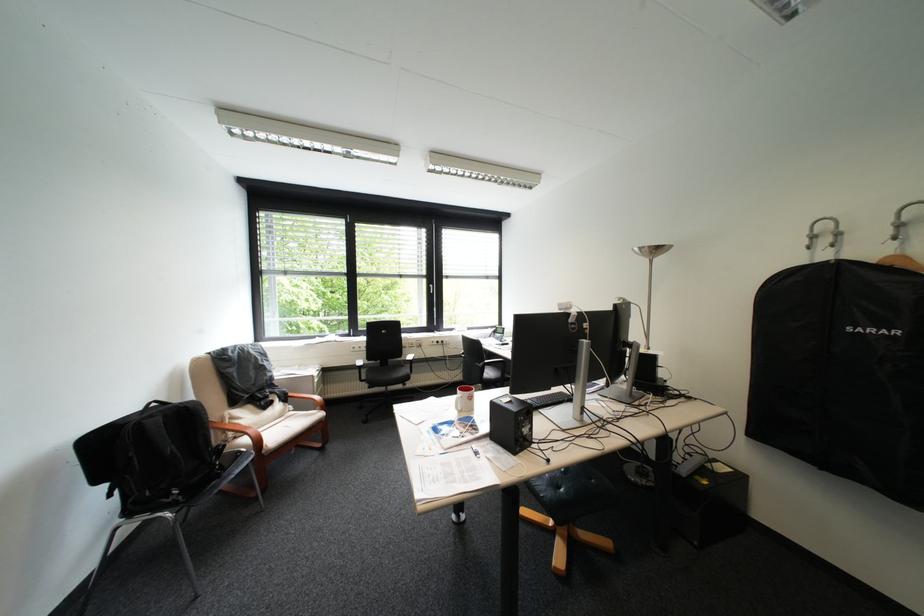
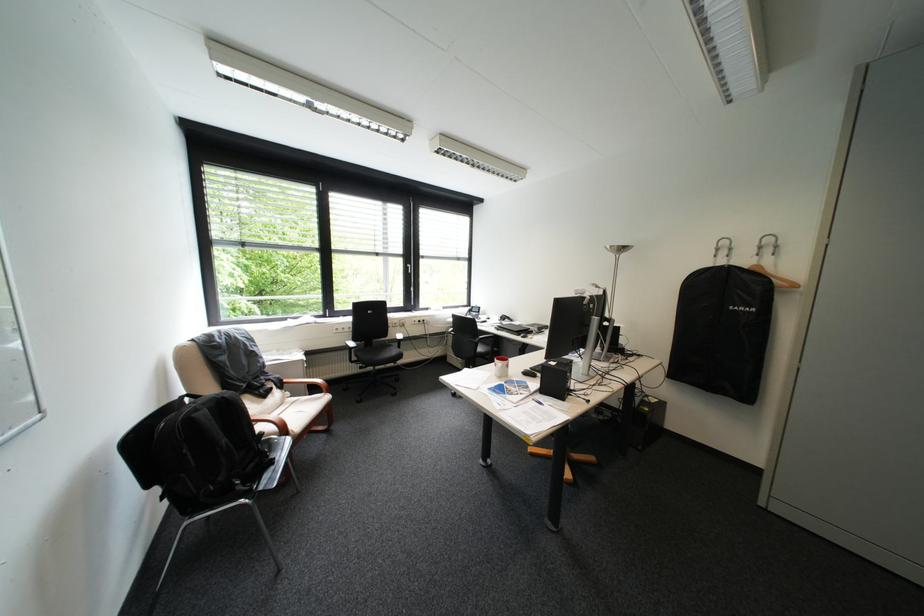
Where in the second image is the point corresponding to (886,262) from the first image?

(759, 268)